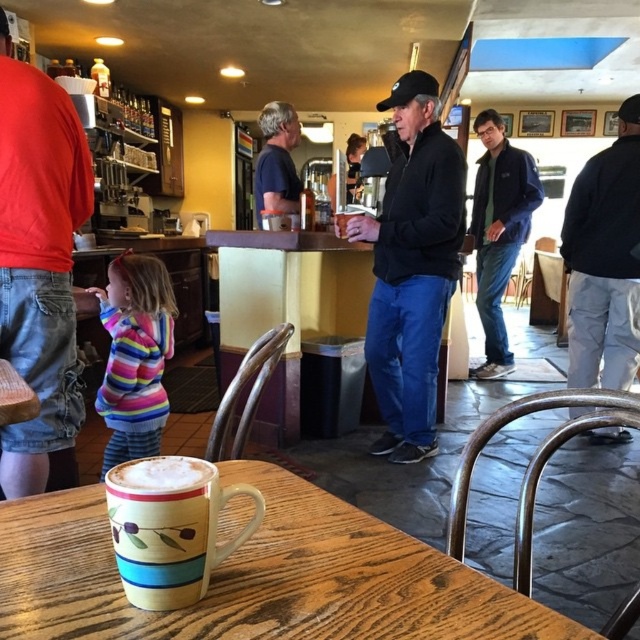
Question: Which of the following is the farthest from the observer?

Choices:
 (A) striped fleece jacket at left
 (B) dark blue jacket at right

Answer: (B)

Question: Is multicolored ceramic mug at lower left closer to the viewer compared to dark blue t-shirt at center?

Choices:
 (A) yes
 (B) no

Answer: (A)

Question: Does black matte jacket at center have a smaller size compared to translucent glass cup at upper center?

Choices:
 (A) yes
 (B) no

Answer: (B)

Question: Estimate the real-world distances between objects in this image. Which object is closer to the dark blue jacket at center?

Choices:
 (A) striped fleece jacket at left
 (B) dark blue jacket at right
 (C) translucent glass cup at upper center
 (D) matte ceramic mug at lower center

Answer: (B)

Question: Which point is closer to the camera taking this photo?

Choices:
 (A) (170, 474)
 (B) (490, 289)
 (C) (260, 129)
 (D) (77, 160)

Answer: (A)

Question: Is wooden table at center bigger than dark blue jacket at center?

Choices:
 (A) yes
 (B) no

Answer: (B)